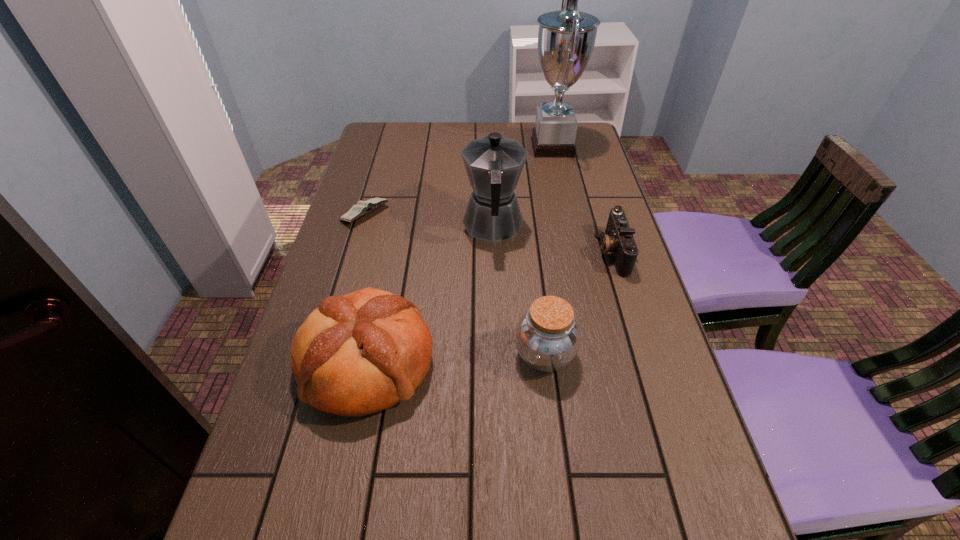
Find the location of a particular element. vacant space located 0.290m at the spout of the coffeepot is located at coordinates (491, 149).

At what (x,y) coordinates should I click in order to perform the action: click on free space located at the spout of the coffeepot. Please return your answer as a coordinate pair (x, y). The image size is (960, 540). Looking at the image, I should click on (492, 173).

Find the location of a particular element. This screenshot has width=960, height=540. vacant region located 0.380m at the spout of the coffeepot is located at coordinates (491, 136).

At what (x,y) coordinates should I click in order to perform the action: click on vacant space located 0.300m on the back of the bread. Please return your answer as a coordinate pair (x, y). The height and width of the screenshot is (540, 960). Looking at the image, I should click on (396, 228).

You are a GUI agent. You are given a task and a screenshot of the screen. Output one action in this format:
    pyautogui.click(x=<x>, y=<y>)
    Task: Click on the free space located 0.330m on the back of the jar
    This screenshot has width=960, height=540.
    Given the screenshot: What is the action you would take?
    pyautogui.click(x=530, y=234)

Locate an element on the screen. free space located on the front-facing side of the second shortest object is located at coordinates coord(564,252).

Find the location of a particular element. vacant space located 0.130m on the front-facing side of the second shortest object is located at coordinates (548, 252).

Locate an element on the screen. This screenshot has width=960, height=540. free space located 0.330m on the front-facing side of the second shortest object is located at coordinates (472, 252).

Identify the location of free space located on the back of the diary. coord(375,178).

Locate an element on the screen. object present at the far edge is located at coordinates (566, 38).